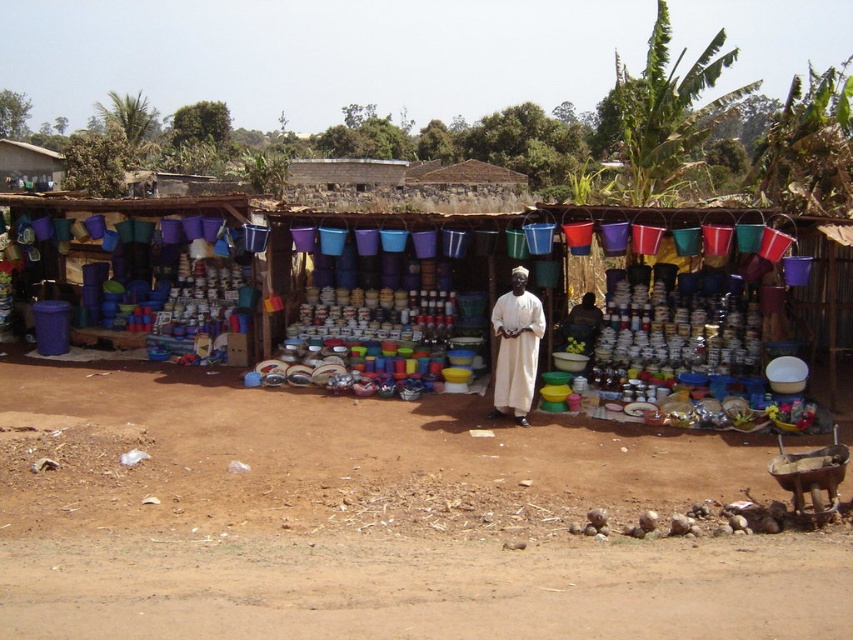
Question: Can you confirm if brown dirt field at lower center is bigger than white cotton dress at center?

Choices:
 (A) no
 (B) yes

Answer: (A)

Question: Considering the relative positions of multicolored plastic buckets at center and white cotton dress at center in the image provided, where is multicolored plastic buckets at center located with respect to white cotton dress at center?

Choices:
 (A) left
 (B) right

Answer: (A)

Question: Which point is farther to the camera?

Choices:
 (A) (370, 369)
 (B) (532, 348)

Answer: (A)

Question: Can you confirm if brown dirt field at lower center is positioned to the left of white cotton dress at center?

Choices:
 (A) no
 (B) yes

Answer: (B)

Question: Which point is farther from the camera taking this photo?

Choices:
 (A) 610,328
 (B) 540,310
 (C) 717,484

Answer: (A)

Question: Which object is the farthest from the multicolored plastic buckets at center?

Choices:
 (A) white cotton dress at center
 (B) brown dirt field at lower center

Answer: (B)